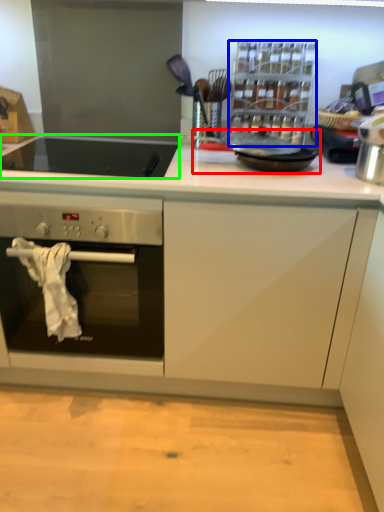
Question: Which is nearer to the frying pan (highlighted by a red box)? appliance (highlighted by a blue box) or gas stove (highlighted by a green box).

Choices:
 (A) appliance
 (B) gas stove

Answer: (A)